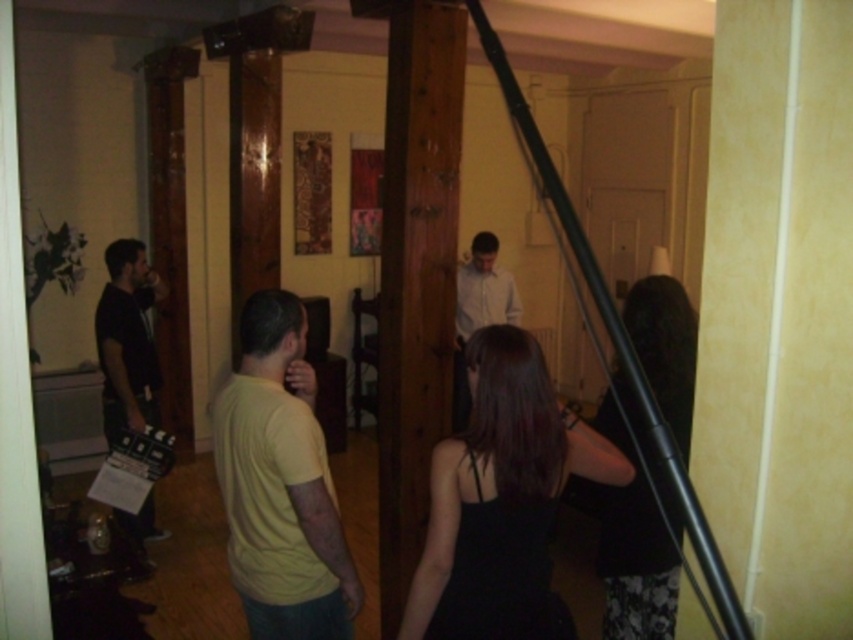
Question: Among these objects, which one is nearest to the camera?

Choices:
 (A) white matte shirt at center
 (B) brown wood pillar at center

Answer: (B)

Question: Which of these objects is positioned closest to the black matte dress at lower right?

Choices:
 (A) brown wood pillar at center
 (B) yellow matte shirt at center
 (C) white matte shirt at center
 (D) black satin dress at center

Answer: (D)

Question: Where is black satin dress at center located in relation to black matte dress at lower right in the image?

Choices:
 (A) right
 (B) left

Answer: (B)

Question: Considering the relative positions of black satin dress at center and yellow matte shirt at center in the image provided, where is black satin dress at center located with respect to yellow matte shirt at center?

Choices:
 (A) left
 (B) right

Answer: (B)

Question: In this image, where is black satin dress at center located relative to yellow matte shirt at center?

Choices:
 (A) below
 (B) above

Answer: (A)

Question: Which point appears farthest from the camera in this image?

Choices:
 (A) (630, 500)
 (B) (463, 20)
 (C) (325, 465)

Answer: (B)